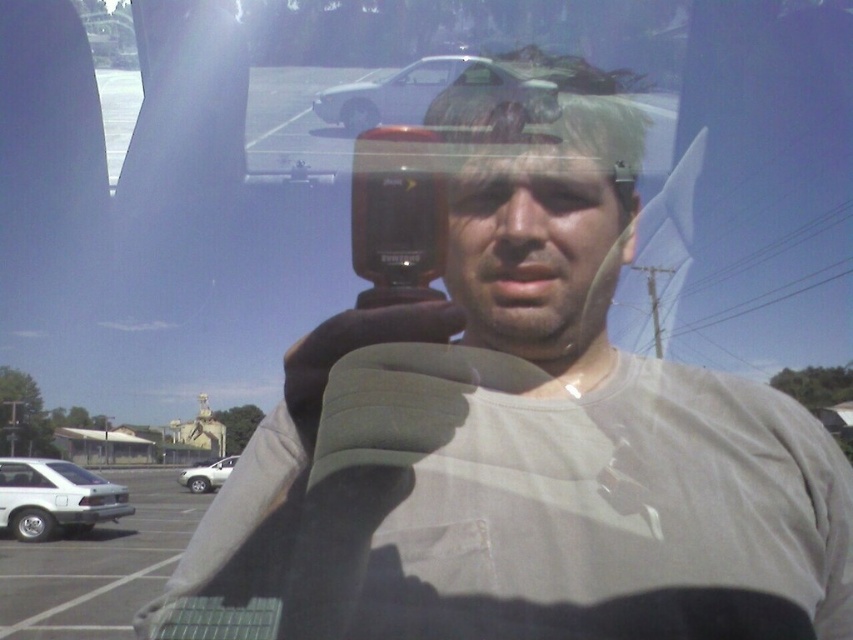
You are standing in the parking lot and want to take a photo of the silver metallic car at upper center and the silver metallic suv at lower left. Which vehicle should you focus on first if you want to capture both in a single shot without moving the camera?

You should focus on the silver metallic car at upper center first because it is closer to the viewer than the silver metallic suv at lower left, so it will be in focus first when adjusting the camera settings.

You are standing at the center of the parking lot and see the white matte car at lower left. Based on its position, can you determine if it is closer to you or farther away compared to the other cars?

The white matte car at lower left is located at point (97, 564), which places it closer to the viewer than the other cars parked farther back in the parking lot.